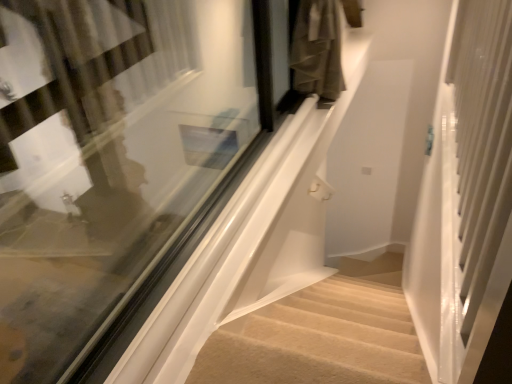
Question: Is beige carpeted stairs at lower center taller or shorter than white glossy screen door at right?

Choices:
 (A) tall
 (B) short

Answer: (B)

Question: In the image, is beige carpeted stairs at lower center positioned in front of or behind white glossy screen door at right?

Choices:
 (A) front
 (B) behind

Answer: (B)

Question: Which object is the closest to the clear glass window at center?

Choices:
 (A) white glossy screen door at right
 (B) beige carpeted stairs at lower center

Answer: (B)

Question: Which object is the farthest from the clear glass window at center?

Choices:
 (A) white glossy screen door at right
 (B) beige carpeted stairs at lower center

Answer: (A)